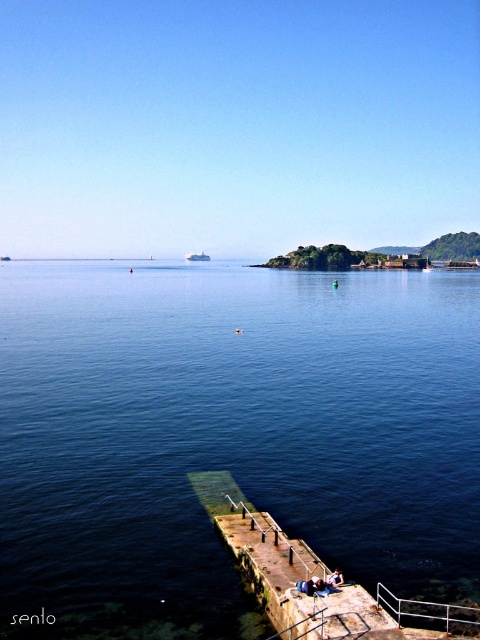
Question: Can you confirm if blue water at center is thinner than white metal rail at lower right?

Choices:
 (A) no
 (B) yes

Answer: (A)

Question: Based on their relative distances, which object is farther from the blue water at center?

Choices:
 (A) blue denim jeans at lower center
 (B) white glossy boat at center
 (C) white metal rail at lower right
 (D) denim jacket at lower center

Answer: (B)

Question: Does white metal rail at lower right have a lesser width compared to white glossy boat at center?

Choices:
 (A) no
 (B) yes

Answer: (B)

Question: Based on their relative distances, which object is nearer to the blue denim jeans at lower center?

Choices:
 (A) blue water at center
 (B) white glossy boat at center
 (C) white metal rail at lower right
 (D) denim jacket at lower center

Answer: (D)

Question: Is blue water at center behind white metal rail at lower right?

Choices:
 (A) no
 (B) yes

Answer: (B)

Question: Which point is closer to the camera?

Choices:
 (A) (187, 256)
 (B) (322, 586)
 (C) (342, 573)

Answer: (B)